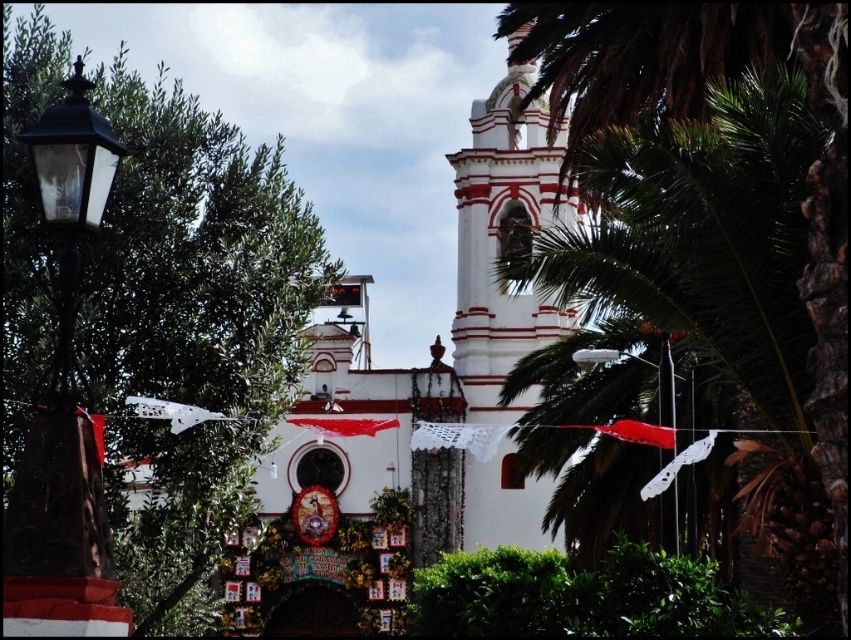
You are standing in front of the white church with red accents and see the green leafy palm tree at center and the white glossy streetlamp at center. Which object is positioned higher from the ground?

The green leafy palm tree at center is located above the white glossy streetlamp at center, so it is positioned higher from the ground.

In the scene shown: You are a visitor at the church and want to take a photo of the white glossy streetlamp at center without the green leafy tree at left blocking it. What should you do?

Move to the right side of the green leafy tree at left so that the white glossy streetlamp at center is visible behind it, as the green leafy tree at left is in front of the white glossy streetlamp at center.

You are standing in front of the church and see the green leafy palm tree at center and the white glossy streetlamp at center. Which object is positioned to the right of the other?

The green leafy palm tree at center is to the right of the white glossy streetlamp at center.